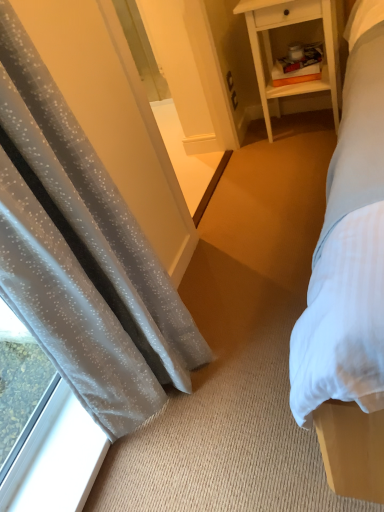
This screenshot has height=512, width=384. Describe the element at coordinates (56, 459) in the screenshot. I see `transparent glass window at lower left` at that location.

Identify the location of white wood nightstand at upper right. The width and height of the screenshot is (384, 512). (271, 48).

The height and width of the screenshot is (512, 384). I want to click on transparent glass window at lower left, so click(56, 459).

Locate an element on the screen. curtain on the right side of transparent glass window at lower left is located at coordinates (82, 254).

Who is taller, translucent gray curtain at left or transparent glass window at lower left?

translucent gray curtain at left is taller.

From the image's perspective, which one is positioned higher, translucent gray curtain at left or transparent glass window at lower left?

translucent gray curtain at left appears higher in the image.

What's the angular difference between translucent gray curtain at left and white wood nightstand at upper right's facing directions?

The angular difference between translucent gray curtain at left and white wood nightstand at upper right is 92.3 degrees.

Consider the image. From a real-world perspective, who is located lower, translucent gray curtain at left or white wood nightstand at upper right?

white wood nightstand at upper right, from a real-world perspective.

Is point (3, 4) closer or farther from the camera than point (263, 91)?

Point (3, 4).

Does translucent gray curtain at left have a smaller size compared to white wood nightstand at upper right?

No, translucent gray curtain at left is not smaller than white wood nightstand at upper right.

Can you confirm if white wood nightstand at upper right is taller than transparent glass window at lower left?

Correct, white wood nightstand at upper right is much taller as transparent glass window at lower left.

In order to click on window to the left of white wood nightstand at upper right in this screenshot , I will do point(56,459).

Is white wood nightstand at upper right oriented away from transparent glass window at lower left?

No, transparent glass window at lower left is not at the back of white wood nightstand at upper right.

Would you consider white wood nightstand at upper right to be distant from transparent glass window at lower left?

Yes.

Choose the correct answer: Is transparent glass window at lower left inside translucent gray curtain at left or outside it?

transparent glass window at lower left is spatially situated outside translucent gray curtain at left.

Between transparent glass window at lower left and translucent gray curtain at left, which one appears on the left side from the viewer's perspective?

Positioned to the left is transparent glass window at lower left.

From the image's perspective, is transparent glass window at lower left positioned above or below translucent gray curtain at left?

Clearly, from the image's perspective, transparent glass window at lower left is below translucent gray curtain at left.

Is transparent glass window at lower left oriented towards translucent gray curtain at left?

No, transparent glass window at lower left is not aimed at translucent gray curtain at left.

How distant is transparent glass window at lower left from white wood nightstand at upper right?

1.79 meters.

Is transparent glass window at lower left behind white wood nightstand at upper right?

No, the depth of transparent glass window at lower left is less than that of white wood nightstand at upper right.

Which is more to the right, transparent glass window at lower left or white wood nightstand at upper right?

From the viewer's perspective, white wood nightstand at upper right appears more on the right side.

Between transparent glass window at lower left and white wood nightstand at upper right, which one has larger width?

With larger width is white wood nightstand at upper right.

Is there a large distance between white wood nightstand at upper right and translucent gray curtain at left?

Yes, white wood nightstand at upper right and translucent gray curtain at left are located far from each other.

Who is bigger, white wood nightstand at upper right or translucent gray curtain at left?

With larger size is translucent gray curtain at left.

Who is more distant, white wood nightstand at upper right or translucent gray curtain at left?

white wood nightstand at upper right.

At what (x,y) coordinates should I click in order to perform the action: click on window below the translucent gray curtain at left (from the image's perspective). Please return your answer as a coordinate pair (x, y). This screenshot has height=512, width=384. Looking at the image, I should click on (56, 459).

You are a GUI agent. You are given a task and a screenshot of the screen. Output one action in this format:
    pyautogui.click(x=<x>, y=<y>)
    Task: Click on the nightstand behind the translucent gray curtain at left
    
    Given the screenshot: What is the action you would take?
    pyautogui.click(x=271, y=48)

When comparing their distances from transparent glass window at lower left, does translucent gray curtain at left or white wood nightstand at upper right seem further?

The object further to transparent glass window at lower left is white wood nightstand at upper right.

Which object lies further to the anchor point white wood nightstand at upper right, translucent gray curtain at left or transparent glass window at lower left?

The object further to white wood nightstand at upper right is transparent glass window at lower left.

Considering their positions, is transparent glass window at lower left positioned further to translucent gray curtain at left than white wood nightstand at upper right?

Based on the image, white wood nightstand at upper right appears to be further to translucent gray curtain at left.

Which object lies further to the anchor point white wood nightstand at upper right, transparent glass window at lower left or translucent gray curtain at left?

Based on the image, transparent glass window at lower left appears to be further to white wood nightstand at upper right.

When comparing their distances from translucent gray curtain at left, does white wood nightstand at upper right or transparent glass window at lower left seem closer?

transparent glass window at lower left is positioned closer to the anchor translucent gray curtain at left.

When comparing their distances from transparent glass window at lower left, does white wood nightstand at upper right or translucent gray curtain at left seem closer?

translucent gray curtain at left.

I want to click on curtain between white wood nightstand at upper right and transparent glass window at lower left in the up-down direction, so click(x=82, y=254).